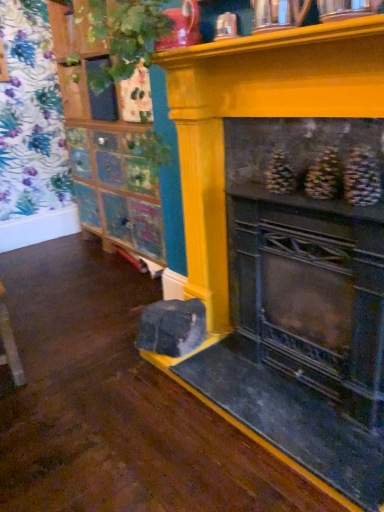
The image size is (384, 512). What are the coordinates of `free spot in front of yellow painted wood fireplace at center` in the screenshot? It's located at (293, 420).